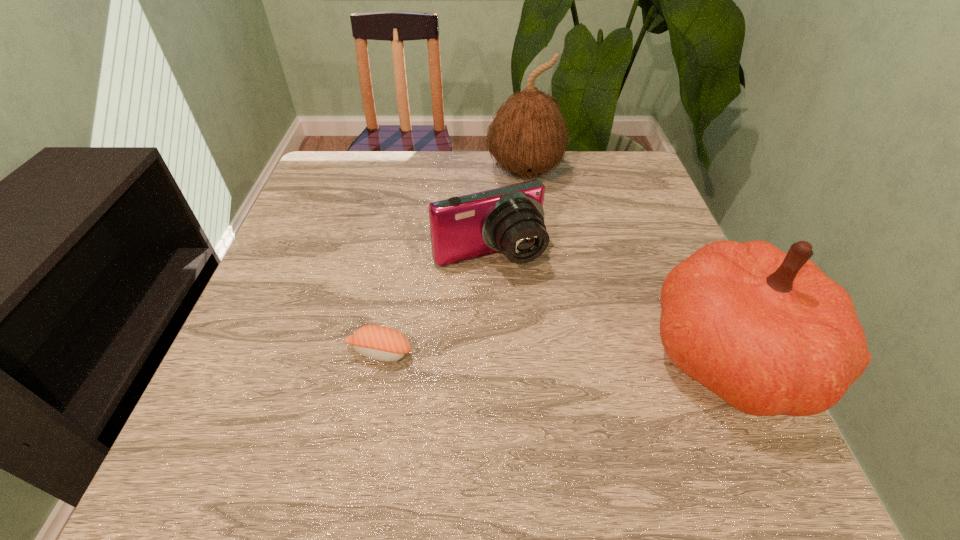
You are a GUI agent. You are given a task and a screenshot of the screen. Output one action in this format:
    pyautogui.click(x=<x>, y=<y>)
    Task: Click on the free space between the rightmost object and the sushi
    The width and height of the screenshot is (960, 540).
    Given the screenshot: What is the action you would take?
    pyautogui.click(x=556, y=353)

At what (x,y) coordinates should I click in order to perform the action: click on object that stands as the second closest to the shortest object. Please return your answer as a coordinate pair (x, y). Looking at the image, I should click on (769, 332).

Select which object is the second closest to the pumpkin. Please provide its 2D coordinates. Your answer should be formatted as a tuple, i.e. [(x, y)], where the tuple contains the x and y coordinates of a point satisfying the conditions above.

[(528, 137)]

Identify the location of vacant space that satisfies the following two spatial constraints: 1. on the front side of the rightmost object; 2. on the front-facing side of the second shortest object. This screenshot has height=540, width=960. click(491, 354).

This screenshot has height=540, width=960. I want to click on free location that satisfies the following two spatial constraints: 1. on the front side of the coconut; 2. on the front-facing side of the rightmost object, so click(x=548, y=354).

Find the location of a particular element. vacant space that satisfies the following two spatial constraints: 1. on the back side of the camera; 2. on the right side of the shortest object is located at coordinates (397, 256).

I want to click on free location that satisfies the following two spatial constraints: 1. on the front side of the sushi; 2. on the front-facing side of the rightmost object, so click(379, 354).